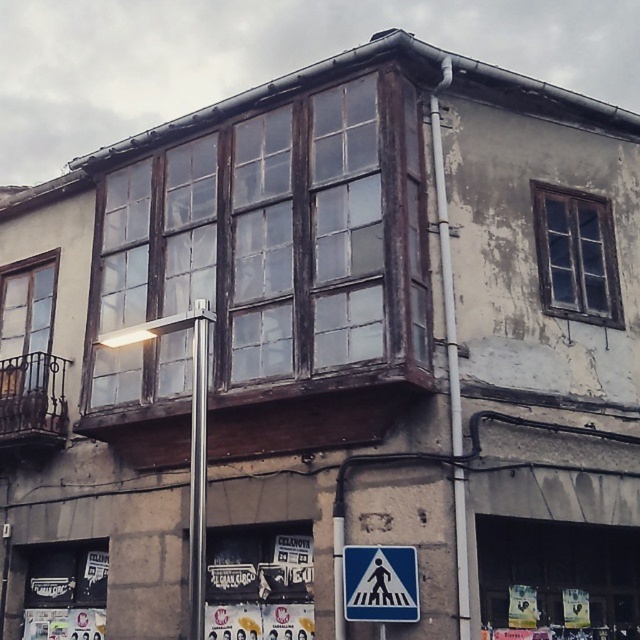
You are a pedestrian standing on the sidewalk in front of the building. You see the wooden bay window at center and the blue plastic pedestrian crossing sign at lower center. Which object is higher up from the ground?

The wooden bay window at center is located above the blue plastic pedestrian crossing sign at lower center, so the wooden bay window at center is higher up from the ground.

You are a pedestrian standing at the corner of the weathered building. You see the blue plastic pedestrian crossing sign at lower center and the silver metallic pole at center. Which object is located to the right of the other?

The blue plastic pedestrian crossing sign at lower center is positioned on the right side of the silver metallic pole at center.